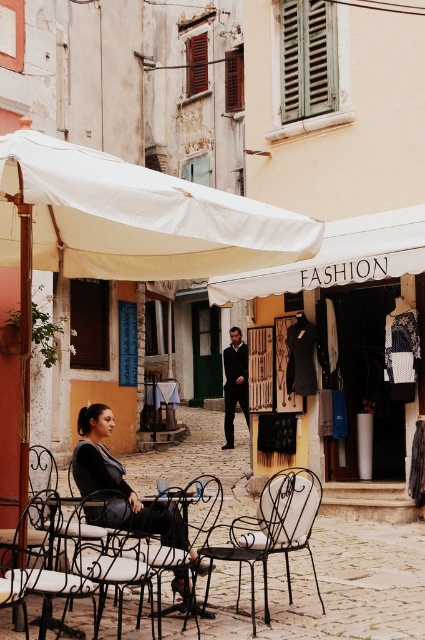
You are standing at the entrance of the quaint European town and want to sit under the large white umbrella. The white wrought iron chair at center is represented by point (277, 529). Which direction should you walk from the entrance to reach the chair?

The white wrought iron chair at center is located at point (277, 529), so you should walk towards the center of the image to reach the chair.

You are sitting at the black wrought iron chair at center in the quaint European town scene. You want to move to the white wrought iron chair at center. In which direction should you move to reach it?

The white wrought iron chair at center is to the right of the black wrought iron chair at center, so you should move to the right to reach it.

You are a photographer trying to capture the woman in the matte black dress at center. According to the coordinates provided, where should you position your camera to ensure she is centered in your shot?

The matte black dress at center is located at coordinates point (121, 488), so you should position your camera to aim directly at that point to center her in the shot.